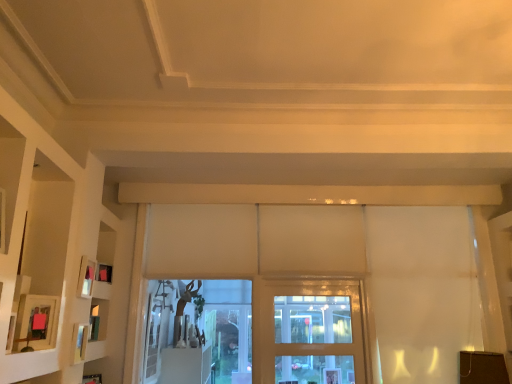
Question: Looking at the image, does matte black picture frame at left, arranged as the third picture frame when viewed from the front, seem bigger or smaller compared to white matte shelf at left?

Choices:
 (A) big
 (B) small

Answer: (B)

Question: In the image, is matte black picture frame at left, the 1th picture frame when ordered from back to front, on the left side or the right side of white matte shelf at left?

Choices:
 (A) left
 (B) right

Answer: (B)

Question: Which object is the farthest from the matte black picture frame at left, arranged as the third picture frame when viewed from the front?

Choices:
 (A) white matte shelf at left
 (B) matte wooden picture frame at left, the second picture frame from the back
 (C) clear glass door at center
 (D) matte pink picture frame at left, acting as the 3th picture frame starting from the back

Answer: (C)

Question: Considering the real-world distances, which object is farthest from the matte pink picture frame at left, the first picture frame positioned from the front?

Choices:
 (A) matte black picture frame at left, the 1th picture frame when ordered from back to front
 (B) clear glass door at center
 (C) white matte shelf at left
 (D) matte wooden picture frame at left, the 2th picture frame from the front

Answer: (B)